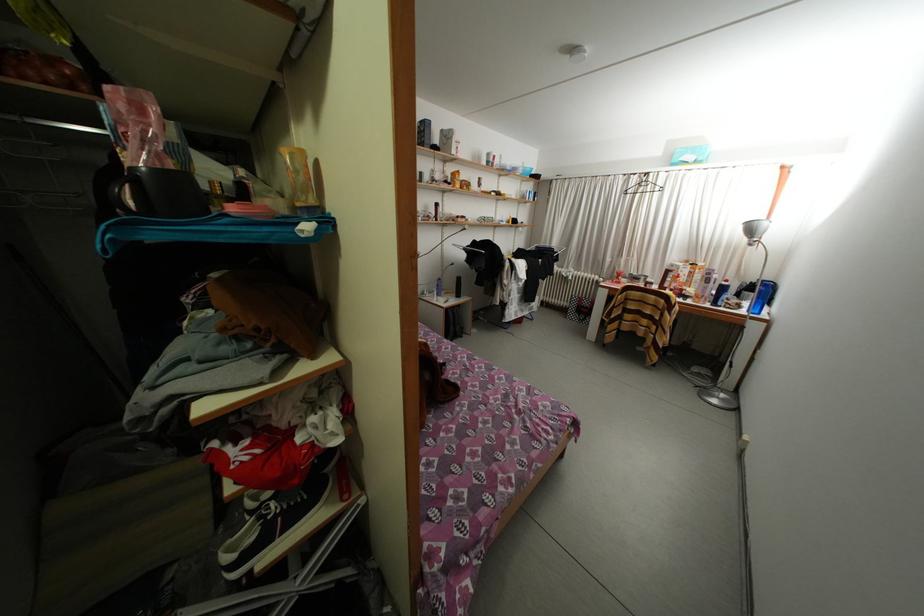
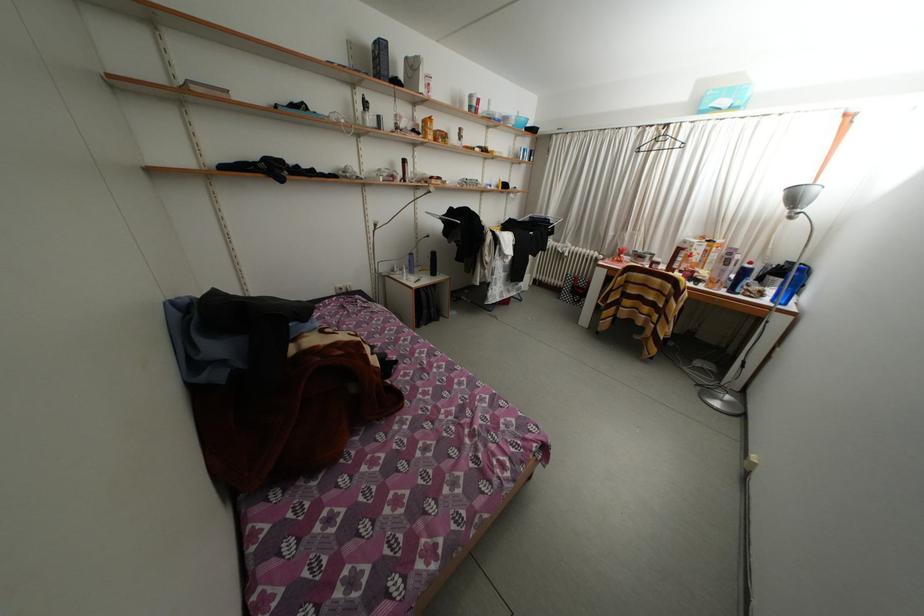
Which direction would the cameraman need to move to produce the second image?

The movement direction of the cameraman is right, forward.